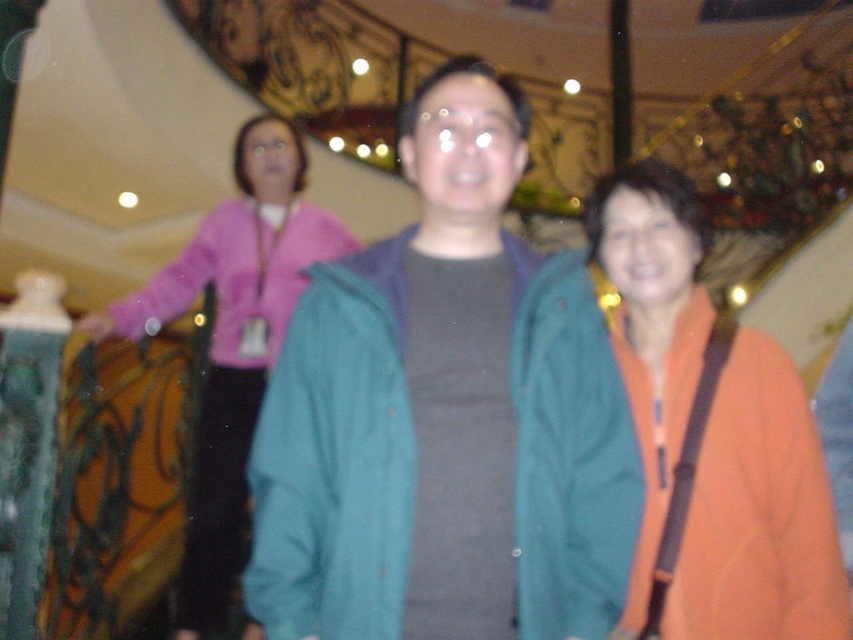
Between orange fabric at right and pink fabric at upper left, which one has more height?

pink fabric at upper left is taller.

Can you confirm if orange fabric at right is bigger than pink fabric at upper left?

No, orange fabric at right is not bigger than pink fabric at upper left.

In order to click on orange fabric at right in this screenshot , I will do `click(758, 513)`.

Where is `teal fabric jacket at center`? The image size is (853, 640). teal fabric jacket at center is located at coordinates 335,458.

Does teal fabric jacket at center have a greater width compared to pink fabric jacket at upper left?

In fact, teal fabric jacket at center might be narrower than pink fabric jacket at upper left.

What do you see at coordinates (335, 458) in the screenshot?
I see `teal fabric jacket at center` at bounding box center [335, 458].

I want to click on teal fabric jacket at center, so click(x=335, y=458).

Which is above, pink fabric at upper left or pink fabric jacket at upper left?

pink fabric jacket at upper left

Which is in front, point (292, 260) or point (257, 257)?

Point (292, 260) is more forward.

At what (x,y) coordinates should I click in order to perform the action: click on pink fabric at upper left. Please return your answer as a coordinate pair (x, y). This screenshot has height=640, width=853. Looking at the image, I should click on (231, 340).